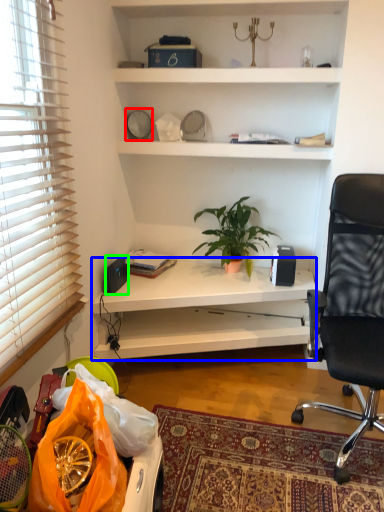
Question: Which is nearer to the clock (highlighted by a red box)? desk (highlighted by a blue box) or loudspeaker (highlighted by a green box).

Choices:
 (A) desk
 (B) loudspeaker

Answer: (B)